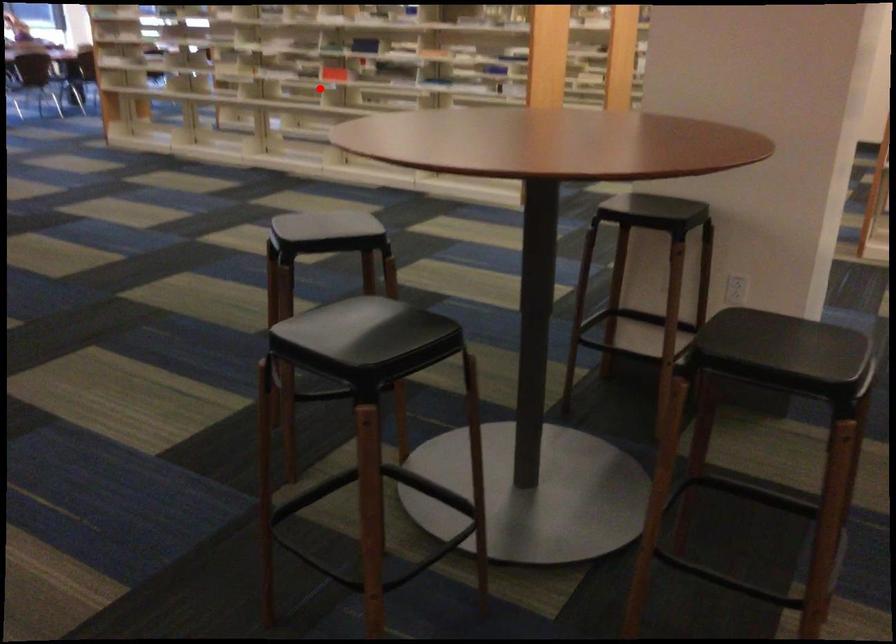
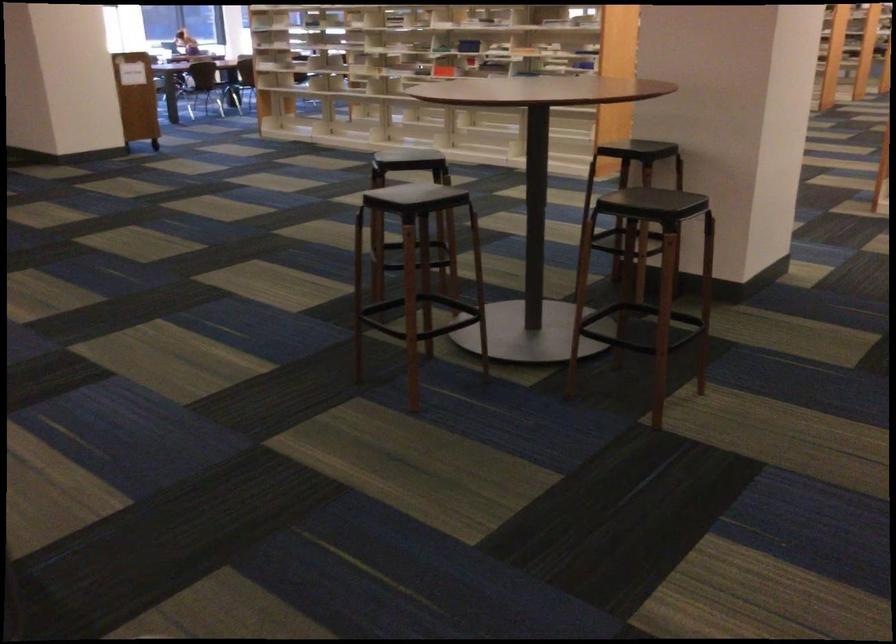
Find the pixel in the second image that matches the highlighted location in the first image.

(418, 75)